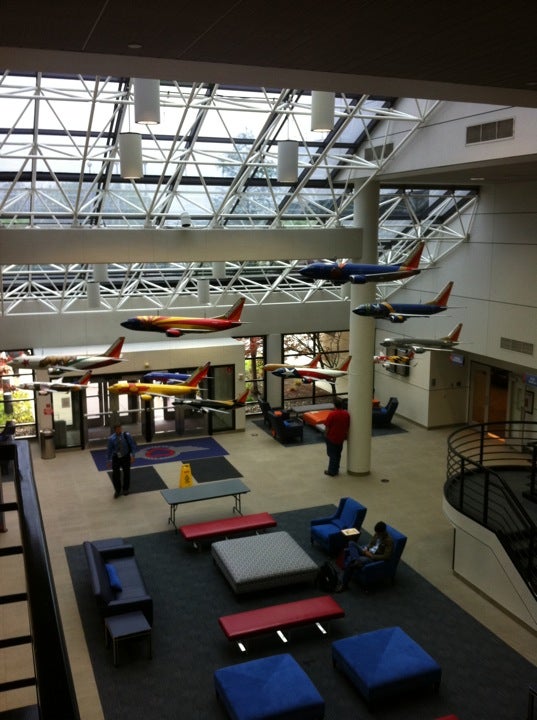
This screenshot has height=720, width=537. I want to click on table, so click(195, 494).